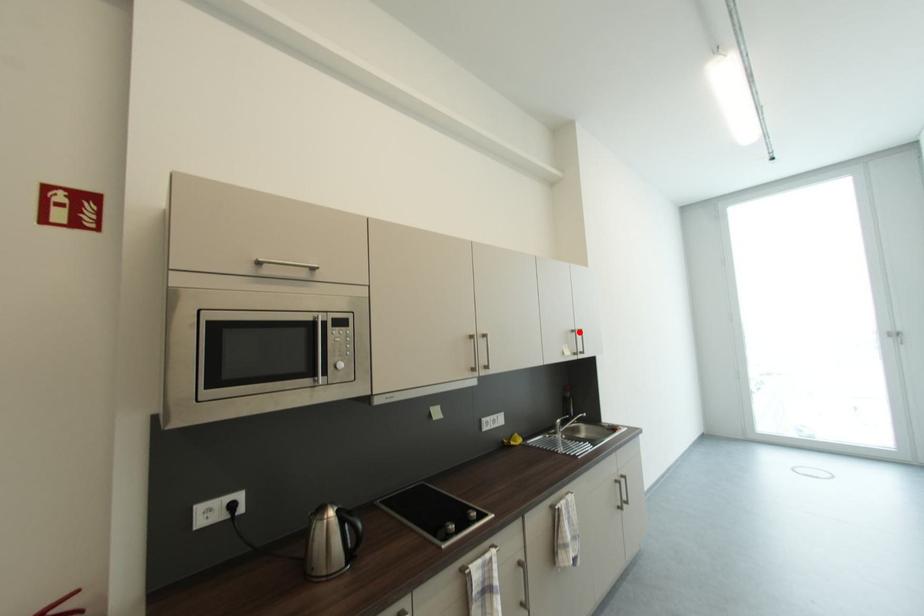
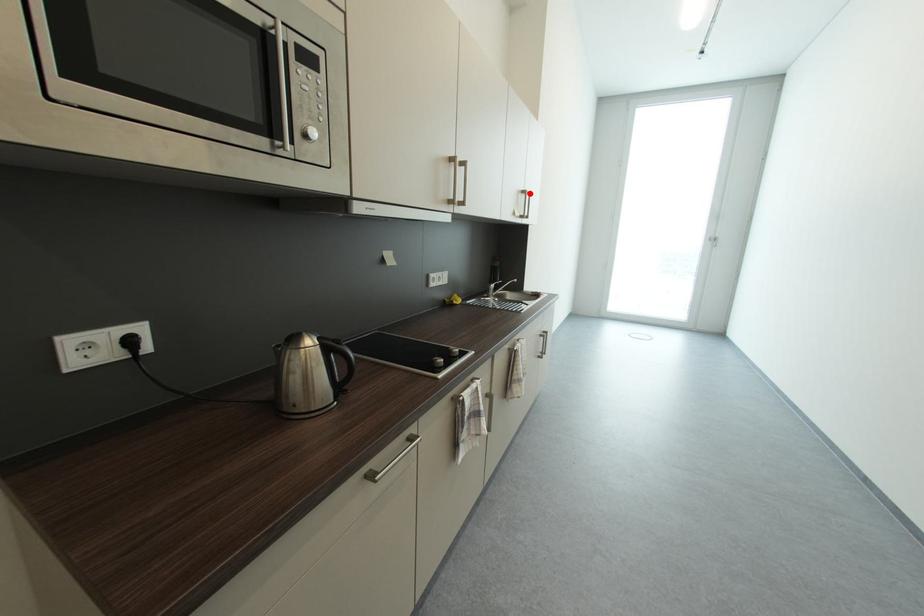
I am providing you with two images of the same scene from different viewpoints. A red point is marked on the first image and another point is marked on the second image. Is the marked point in image1 the same physical position as the marked point in image2?

Yes